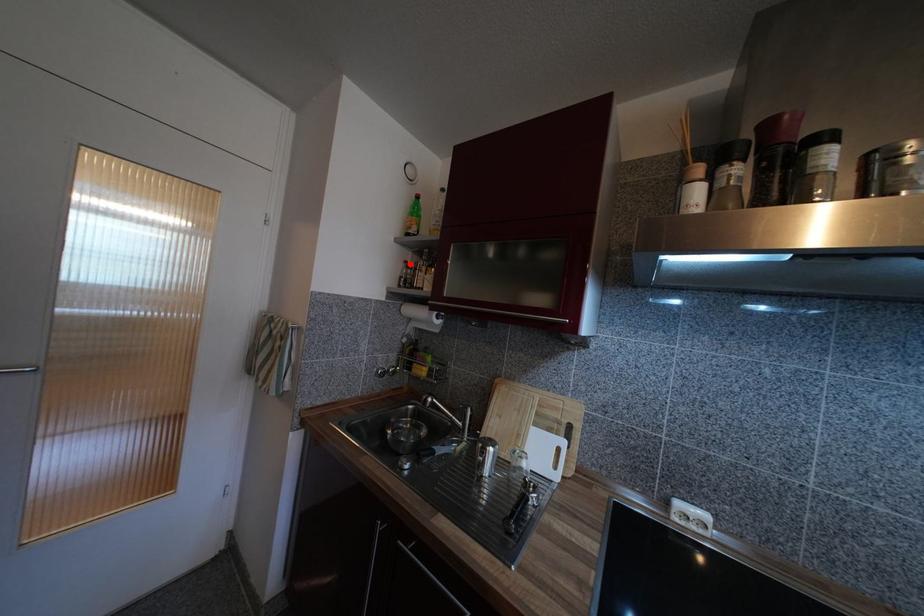
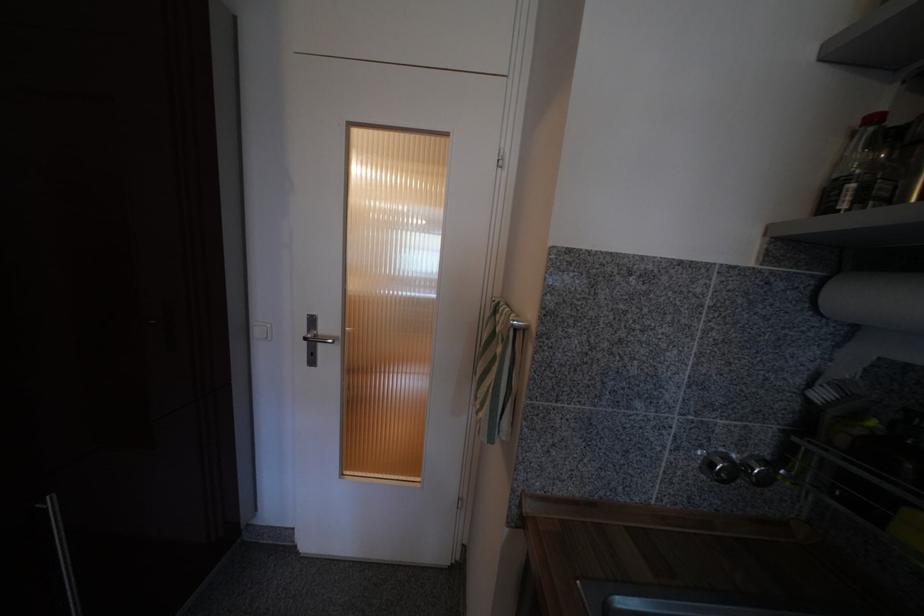
The point at the highlighted location is marked in the first image. Where is the corresponding point in the second image?

(879, 121)